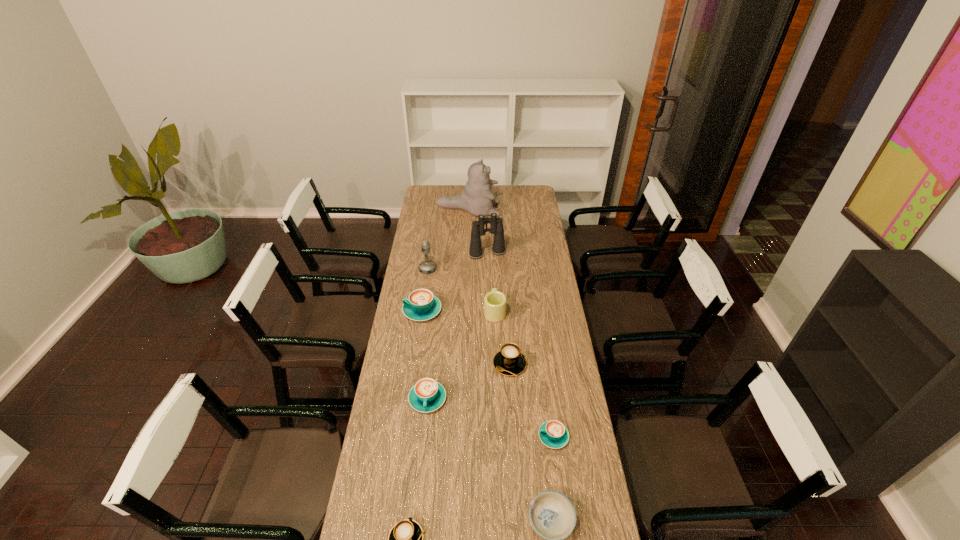
You are a GUI agent. You are given a task and a screenshot of the screen. Output one action in this format:
    pyautogui.click(x=<x>, y=<y>)
    Task: Click on the tallest object
    Image resolution: width=960 pixels, height=540 pixels.
    Given the screenshot: What is the action you would take?
    pyautogui.click(x=477, y=199)

At what (x,y) coordinates should I click in order to perform the action: click on the farthest object. Please return your answer as a coordinate pair (x, y). Image resolution: width=960 pixels, height=540 pixels. Looking at the image, I should click on (477, 199).

Where is `the ninth shortest object`? This screenshot has height=540, width=960. the ninth shortest object is located at coordinates (496, 224).

In order to click on binoculars in this screenshot , I will do pyautogui.click(x=496, y=224).

At what (x,y) coordinates should I click in order to perform the action: click on microphone. Please return your answer as a coordinate pair (x, y). Looking at the image, I should click on 427,266.

Where is `the eighth nearest object`? This screenshot has height=540, width=960. the eighth nearest object is located at coordinates (427, 266).

Locate an element on the screen. This screenshot has width=960, height=540. mug is located at coordinates (494, 302).

Locate an element on the screen. beige mug is located at coordinates (494, 302).

Locate an element on the screen. This screenshot has height=540, width=960. the farthest cappuccino is located at coordinates (421, 305).

I want to click on the farthest turquoise cappuccino, so click(421, 305).